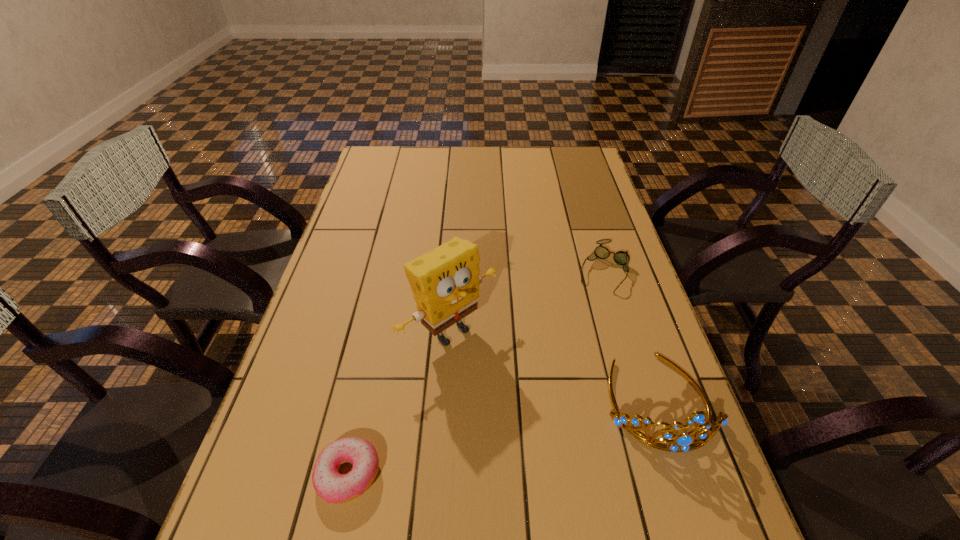
Where is `free space between the sponge and the farthest object`? free space between the sponge and the farthest object is located at coordinates (527, 301).

Identify the location of empty space between the leftmost object and the tiara. (504, 438).

The image size is (960, 540). In order to click on free space between the tiara and the spectacles in this screenshot , I will do `click(632, 335)`.

Image resolution: width=960 pixels, height=540 pixels. What are the coordinates of `unoccupied position between the sponge and the tiara` in the screenshot? It's located at (555, 367).

Identify which object is the second nearest to the spectacles. Please provide its 2D coordinates. Your answer should be formatted as a tuple, i.e. [(x, y)], where the tuple contains the x and y coordinates of a point satisfying the conditions above.

[(445, 282)]

Where is `the second closest object to the third object from right to left`? the second closest object to the third object from right to left is located at coordinates (684, 442).

Locate an element on the screen. The image size is (960, 540). vacant space that satisfies the following two spatial constraints: 1. on the back side of the sponge; 2. on the right side of the farthest object is located at coordinates (454, 269).

Locate an element on the screen. The image size is (960, 540). vacant space that satisfies the following two spatial constraints: 1. on the back side of the third object from right to left; 2. on the right side of the farthest object is located at coordinates pos(454,269).

In order to click on vacant space that satisfies the following two spatial constraints: 1. on the back side of the doughnut; 2. on the left side of the sponge in this screenshot , I will do `click(379, 333)`.